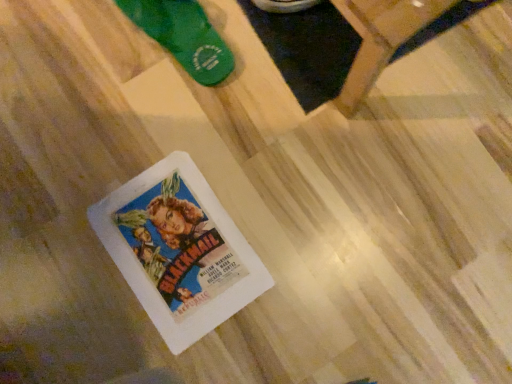
Image resolution: width=512 pixels, height=384 pixels. What are the coordinates of `vacant space to the right of green rubber slipper at upper center` in the screenshot? It's located at (269, 52).